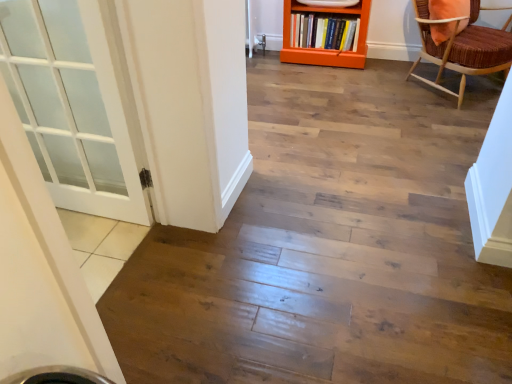
What are the coordinates of `orange wood bookcase at upper center` in the screenshot? It's located at (326, 50).

In order to click on orange wood bookcase at upper center in this screenshot , I will do `click(326, 50)`.

Which of these two, hardcover book at center or orange wood bookcase at upper center, is bigger?

orange wood bookcase at upper center is bigger.

From a real-world perspective, which is physically below, hardcover book at center or orange wood bookcase at upper center?

hardcover book at center, from a real-world perspective.

Is hardcover book at center positioned far away from orange wood bookcase at upper center?

hardcover book at center is actually quite close to orange wood bookcase at upper center.

Considering the positions of objects brown woven chair at upper right and hardcover book at center in the image provided, who is more to the left, brown woven chair at upper right or hardcover book at center?

hardcover book at center.

Is brown woven chair at upper right wider than hardcover book at center?

Correct, the width of brown woven chair at upper right exceeds that of hardcover book at center.

Between brown woven chair at upper right and hardcover book at center, which one has larger size?

brown woven chair at upper right is bigger.

Between point (330, 63) and point (497, 50), which one is positioned behind?

The point (330, 63) is behind.

From a real-world perspective, is orange wood bookcase at upper center positioned above or below brown woven chair at upper right?

orange wood bookcase at upper center is situated lower than brown woven chair at upper right in the real world.

In the scene shown: Between orange wood bookcase at upper center and brown woven chair at upper right, which one has larger width?

With larger width is brown woven chair at upper right.

In the scene shown: Is orange wood bookcase at upper center positioned far away from brown woven chair at upper right?

No, orange wood bookcase at upper center is in close proximity to brown woven chair at upper right.

Looking at the image, does brown woven chair at upper right seem bigger or smaller compared to orange wood bookcase at upper center?

In the image, brown woven chair at upper right appears to be larger than orange wood bookcase at upper center.

Is brown woven chair at upper right next to orange wood bookcase at upper center?

No, brown woven chair at upper right is not making contact with orange wood bookcase at upper center.

Is brown woven chair at upper right situated inside orange wood bookcase at upper center or outside?

brown woven chair at upper right is not inside orange wood bookcase at upper center, it's outside.

Considering the positions of objects brown woven chair at upper right and orange wood bookcase at upper center in the image provided, who is more to the left, brown woven chair at upper right or orange wood bookcase at upper center?

Positioned to the left is orange wood bookcase at upper center.

From the image's perspective, between orange wood bookcase at upper center and hardcover book at center, who is located below?

From the image's view, orange wood bookcase at upper center is below.

Which of these two, orange wood bookcase at upper center or hardcover book at center, is wider?

Wider between the two is orange wood bookcase at upper center.

Considering the relative sizes of orange wood bookcase at upper center and hardcover book at center in the image provided, is orange wood bookcase at upper center smaller than hardcover book at center?

No.

Between hardcover book at center and brown woven chair at upper right, which one appears on the right side from the viewer's perspective?

brown woven chair at upper right is more to the right.

From the image's perspective, between hardcover book at center and brown woven chair at upper right, which one is located above?

hardcover book at center appears higher in the image.

Considering the relative sizes of hardcover book at center and brown woven chair at upper right in the image provided, is hardcover book at center shorter than brown woven chair at upper right?

Correct, hardcover book at center is not as tall as brown woven chair at upper right.

The image size is (512, 384). Identify the location of book behind the orange wood bookcase at upper center. (324, 32).

Where is `book directly beneath the brown woven chair at upper right (from a real-world perspective)`? book directly beneath the brown woven chair at upper right (from a real-world perspective) is located at coordinates (324, 32).

Which object lies nearer to the anchor point hardcover book at center, orange wood bookcase at upper center or brown woven chair at upper right?

Among the two, orange wood bookcase at upper center is located nearer to hardcover book at center.

From the image, which object appears to be nearer to brown woven chair at upper right, hardcover book at center or orange wood bookcase at upper center?

Among the two, orange wood bookcase at upper center is located nearer to brown woven chair at upper right.

From the image, which object appears to be nearer to orange wood bookcase at upper center, hardcover book at center or brown woven chair at upper right?

hardcover book at center lies closer to orange wood bookcase at upper center than the other object.

Based on their spatial positions, is brown woven chair at upper right or orange wood bookcase at upper center closer to hardcover book at center?

orange wood bookcase at upper center is positioned closer to the anchor hardcover book at center.

Considering their positions, is orange wood bookcase at upper center positioned further to brown woven chair at upper right than hardcover book at center?

hardcover book at center is positioned further to the anchor brown woven chair at upper right.

Consider the image. When comparing their distances from orange wood bookcase at upper center, does brown woven chair at upper right or hardcover book at center seem closer?

Based on the image, hardcover book at center appears to be nearer to orange wood bookcase at upper center.

At what (x,y) coordinates should I click in order to perform the action: click on book situated between orange wood bookcase at upper center and brown woven chair at upper right from left to right. Please return your answer as a coordinate pair (x, y). Looking at the image, I should click on (324, 32).